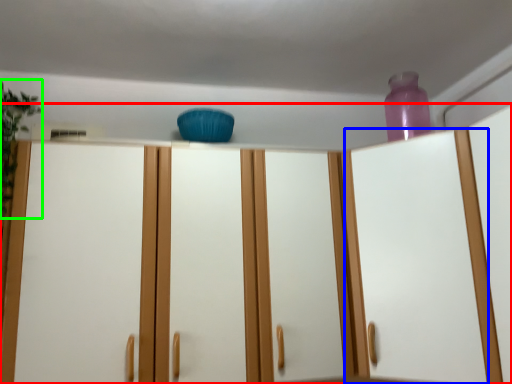
Question: Which is nearer to the cupboard (highlighted by a red box)? glass door (highlighted by a blue box) or plant (highlighted by a green box).

Choices:
 (A) glass door
 (B) plant

Answer: (A)